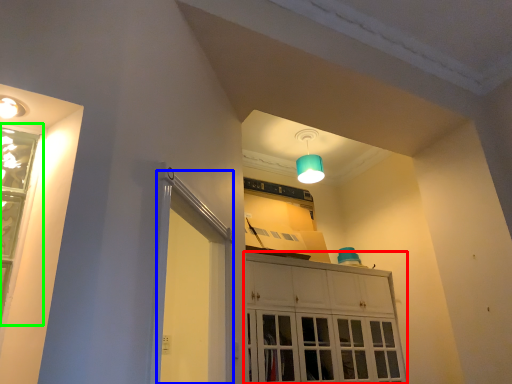
Question: Which object is positioned farthest from cabinetry (highlighted by a red box)? Select from screen door (highlighted by a blue box) and window (highlighted by a green box).

Choices:
 (A) screen door
 (B) window

Answer: (B)